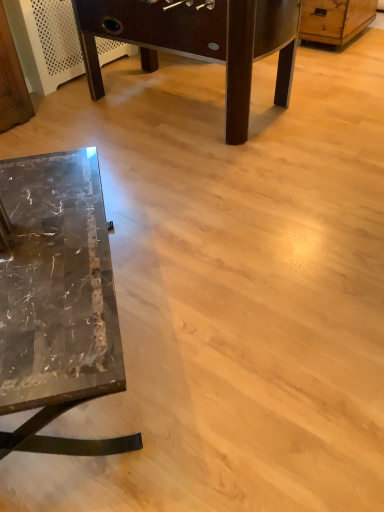
Question: From a real-world perspective, is marble table at lower left, which is the 1th table in top-to-bottom order, positioned over marble table at lower left, the first table when ordered from bottom to top, based on gravity?

Choices:
 (A) no
 (B) yes

Answer: (B)

Question: Is marble table at lower left, which ranks as the second table in front-to-back order, at the right side of marble table at lower left, which appears as the 1th table when viewed from the front?

Choices:
 (A) yes
 (B) no

Answer: (A)

Question: Is marble table at lower left, which is the 2th table in bottom-to-top order, facing away from marble table at lower left, the first table when ordered from bottom to top?

Choices:
 (A) yes
 (B) no

Answer: (A)

Question: Does marble table at lower left, which is the 1th table in top-to-bottom order, have a lesser height compared to marble table at lower left, which is the second table in back-to-front order?

Choices:
 (A) yes
 (B) no

Answer: (B)

Question: Is marble table at lower left, which is the 1th table in top-to-bottom order, oriented towards marble table at lower left, the first table when ordered from bottom to top?

Choices:
 (A) no
 (B) yes

Answer: (A)

Question: Is point (261, 50) positioned closer to the camera than point (304, 9)?

Choices:
 (A) farther
 (B) closer

Answer: (B)

Question: Is marble table at lower left, which is the 1th table in top-to-bottom order, bigger or smaller than wooden dresser at upper right?

Choices:
 (A) big
 (B) small

Answer: (A)

Question: Is marble table at lower left, which ranks as the second table in front-to-back order, in front of or behind wooden dresser at upper right in the image?

Choices:
 (A) front
 (B) behind

Answer: (A)

Question: Looking at their shapes, would you say marble table at lower left, which is the 2th table in bottom-to-top order, is wider or thinner than wooden dresser at upper right?

Choices:
 (A) thin
 (B) wide

Answer: (B)

Question: Based on their positions, is marble table at lower left, which appears as the 1th table when viewed from the front, located to the left or right of wooden dresser at upper right?

Choices:
 (A) right
 (B) left

Answer: (B)

Question: From a real-world perspective, relative to wooden dresser at upper right, is marble table at lower left, the first table when ordered from bottom to top, vertically above or below?

Choices:
 (A) above
 (B) below

Answer: (B)

Question: Looking at the image, does marble table at lower left, which appears as the 1th table when viewed from the front, seem bigger or smaller compared to wooden dresser at upper right?

Choices:
 (A) small
 (B) big

Answer: (B)

Question: Is marble table at lower left, which is the second table in back-to-front order, in front of or behind wooden dresser at upper right in the image?

Choices:
 (A) behind
 (B) front

Answer: (B)

Question: From the image's perspective, is marble table at lower left, which appears as the 1th table when viewed from the front, located above or below marble table at lower left, which is the 1th table in top-to-bottom order?

Choices:
 (A) above
 (B) below

Answer: (B)

Question: Considering the positions of point (51, 266) and point (160, 32), is point (51, 266) closer or farther from the camera than point (160, 32)?

Choices:
 (A) closer
 (B) farther

Answer: (A)